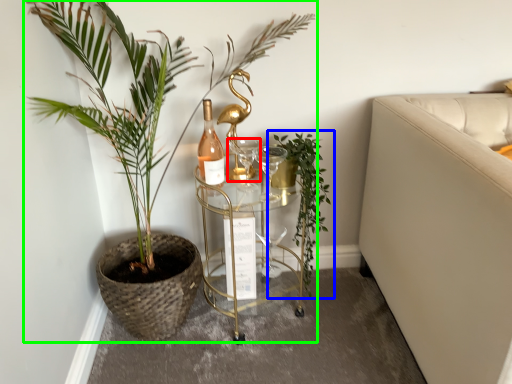
Question: Which object is positioned closest to wine glass (highlighted by a red box)? Select from houseplant (highlighted by a blue box) and houseplant (highlighted by a green box).

Choices:
 (A) houseplant
 (B) houseplant

Answer: (A)